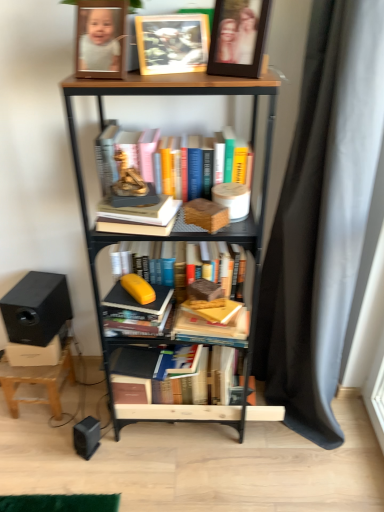
Image resolution: width=384 pixels, height=512 pixels. What are the coordinates of `free location in front of wooden stool at lower left` in the screenshot? It's located at (38, 446).